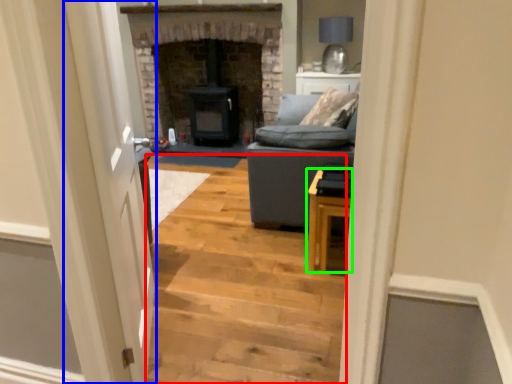
Question: Based on their relative distances, which object is nearer to stairwell (highlighted by a red box)? Choose from glass door (highlighted by a blue box) and table (highlighted by a green box).

Choices:
 (A) glass door
 (B) table

Answer: (B)